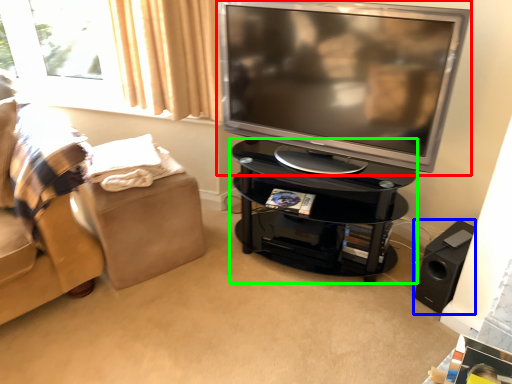
Question: Which is nearer to the television (highlighted by a red box)? speaker (highlighted by a blue box) or table (highlighted by a green box).

Choices:
 (A) speaker
 (B) table

Answer: (B)